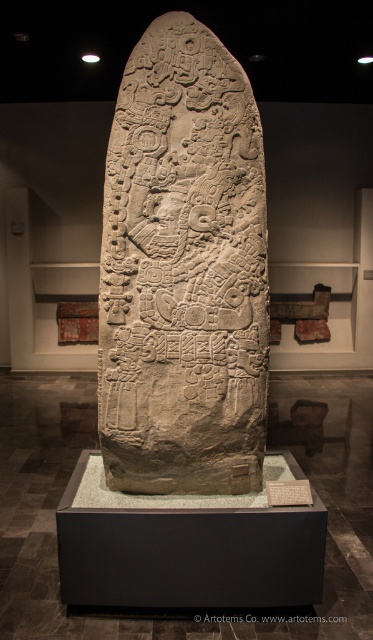
Question: In this image, where is carved stone stele at center located relative to white stone tablet at center?

Choices:
 (A) above
 (B) below

Answer: (A)

Question: Which of the following is the farthest from the observer?

Choices:
 (A) (286, 614)
 (B) (182, 170)

Answer: (B)

Question: Which object appears closest to the camera in this image?

Choices:
 (A) white stone tablet at center
 (B) carved stone stele at center

Answer: (A)

Question: Is the position of carved stone stele at center more distant than that of white stone tablet at center?

Choices:
 (A) no
 (B) yes

Answer: (B)

Question: Can you confirm if carved stone stele at center is bigger than white stone tablet at center?

Choices:
 (A) yes
 (B) no

Answer: (A)